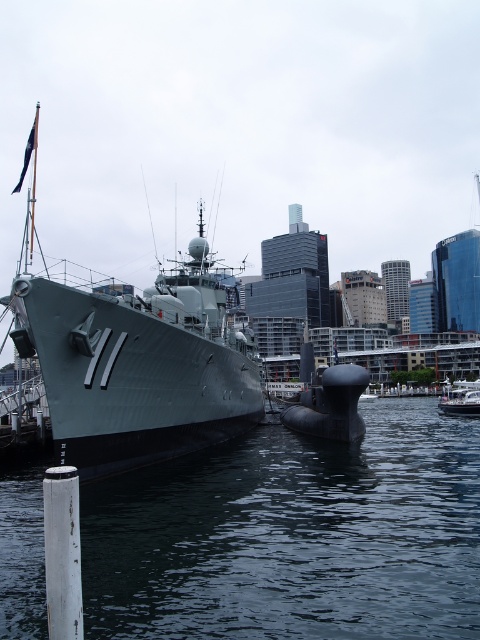
Does dark blue water at lower center have a smaller size compared to matte gray ship at center?

Yes, dark blue water at lower center is smaller than matte gray ship at center.

Identify the location of dark blue water at lower center. (294, 536).

This screenshot has height=640, width=480. Find the location of `dark blue water at lower center`. dark blue water at lower center is located at coordinates (294, 536).

Locate an element on the screen. Image resolution: width=480 pixels, height=640 pixels. dark blue water at lower center is located at coordinates (294, 536).

Can you confirm if matte gray ship at center is thinner than white glossy boat at lower right?

No.

Does point (108, 316) lie behind point (475, 390)?

No, (108, 316) is closer to viewer.

Locate an element on the screen. This screenshot has width=480, height=640. matte gray ship at center is located at coordinates (136, 364).

Between dark blue water at lower center and white glossy boat at lower right, which one appears on the left side from the viewer's perspective?

Positioned to the left is dark blue water at lower center.

Is point (433, 545) more distant than point (456, 401)?

No, it is not.

Who is more distant from viewer, (395, 616) or (463, 388)?

Point (463, 388)

Identify the location of dark blue water at lower center. The width and height of the screenshot is (480, 640). (294, 536).